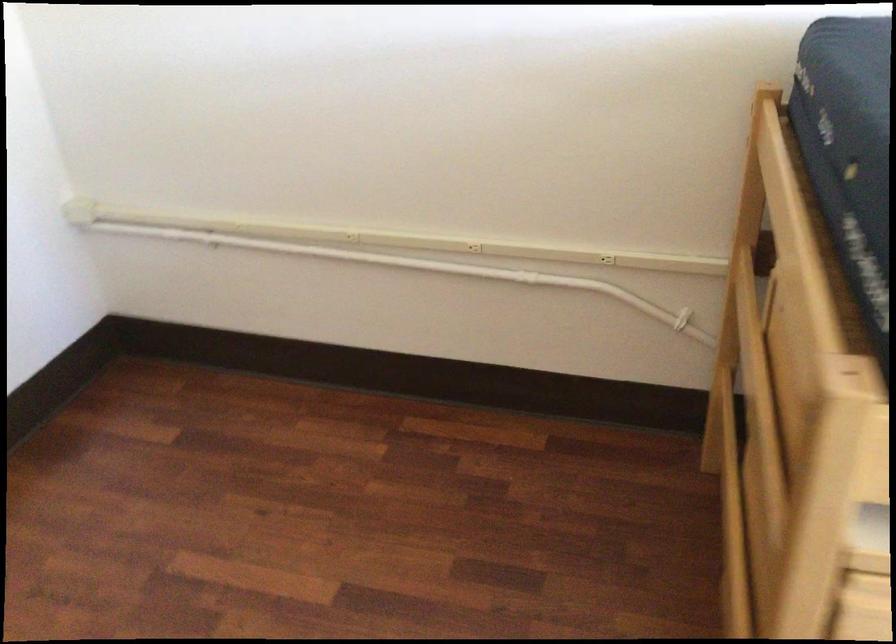
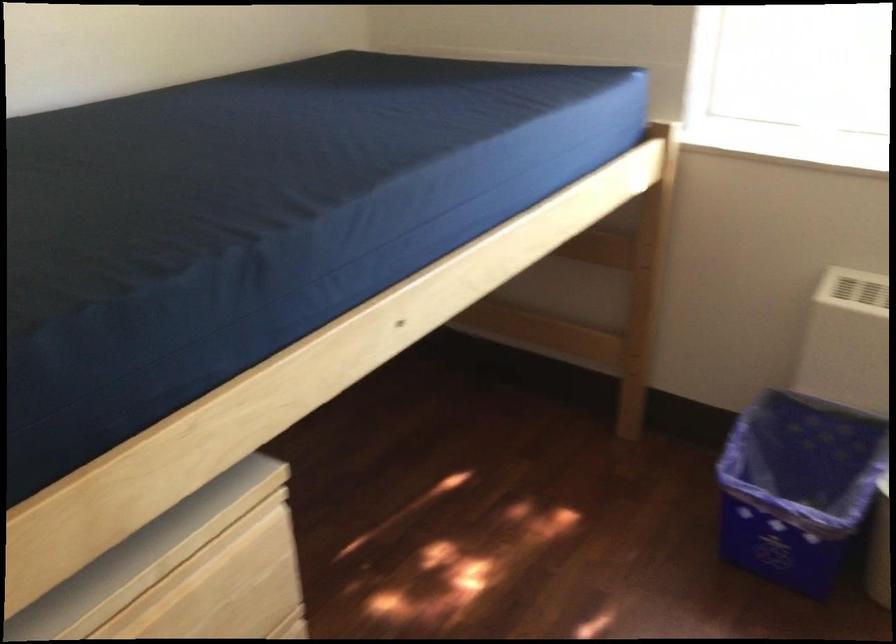
Question: The camera is either moving clockwise (left) or counter-clockwise (right) around the object. The first image is from the beginning of the video and the second image is from the end. Is the camera moving left or right when shooting the video?

Choices:
 (A) Left
 (B) Right

Answer: (A)